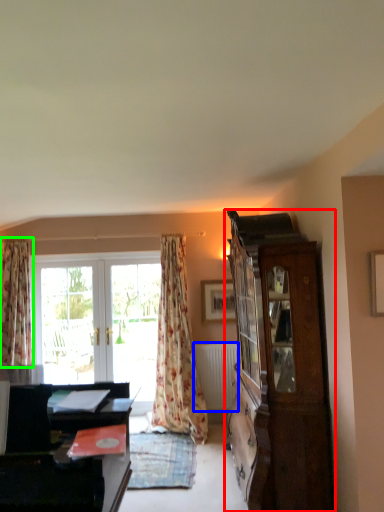
Question: Based on their relative distances, which object is nearer to cabinetry (highlighted by a red box)? Choose from radiator (highlighted by a blue box) and curtain (highlighted by a green box).

Choices:
 (A) radiator
 (B) curtain

Answer: (A)